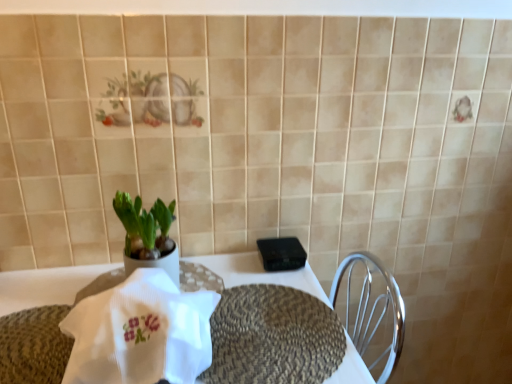
This screenshot has height=384, width=512. I want to click on free space to the left of black plastic device at center, so click(227, 268).